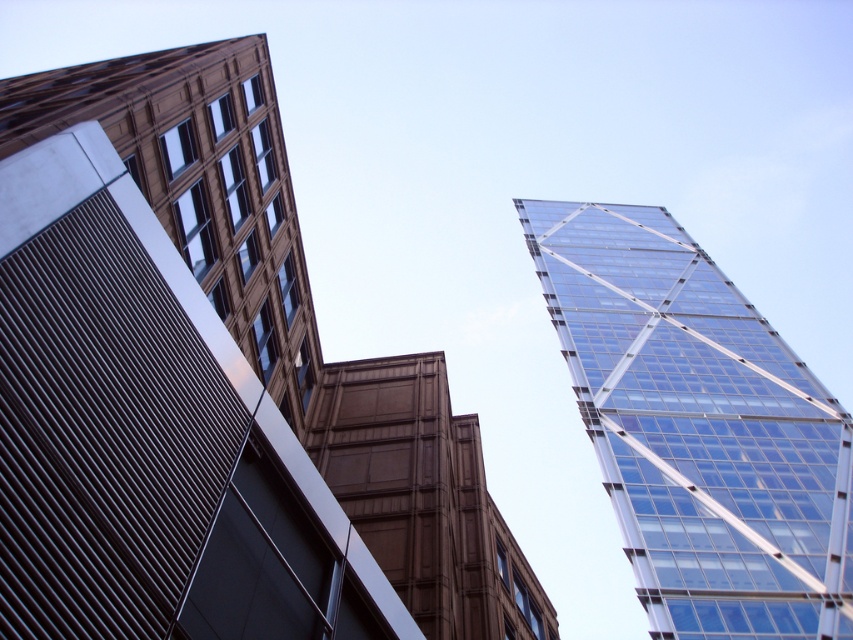
Does transparent glass tower at upper right have a lesser width compared to transparent glass skyscraper at upper right?

Yes.

Between point (654, 602) and point (51, 80), which one is positioned in front?

Point (51, 80)

Is point (746, 500) in front of point (437, 358)?

No, (746, 500) is further to viewer.

Find the location of a particular element. The image size is (853, 640). transparent glass tower at upper right is located at coordinates (698, 428).

Is transparent glass skyscraper at upper right below brown textured building at center?

No, transparent glass skyscraper at upper right is not below brown textured building at center.

Does transparent glass skyscraper at upper right have a larger size compared to brown textured building at center?

Yes.

Does point (541, 595) lie behind point (552, 632)?

No.

The height and width of the screenshot is (640, 853). What are the coordinates of `transparent glass skyscraper at upper right` in the screenshot? It's located at (299, 321).

Who is more forward, (682, 390) or (514, 604)?

Positioned in front is point (514, 604).

Is transparent glass tower at upper right to the left of brown textured building at center from the viewer's perspective?

Incorrect, transparent glass tower at upper right is not on the left side of brown textured building at center.

What are the coordinates of `transparent glass tower at upper right` in the screenshot? It's located at (698, 428).